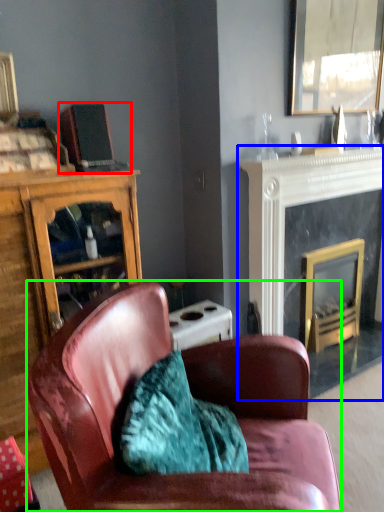
Question: Based on their relative distances, which object is farther from laptop (highlighted by a red box)? Choose from fireplace (highlighted by a blue box) and chair (highlighted by a green box).

Choices:
 (A) fireplace
 (B) chair

Answer: (A)